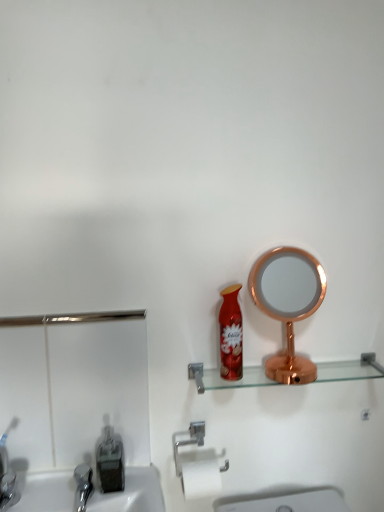
What do you see at coordinates (198, 465) in the screenshot? The image size is (384, 512). I see `silver metallic towel bar at lower center` at bounding box center [198, 465].

At what (x,y) coordinates should I click in order to perform the action: click on brushed metal sink at lower left. Please return your answer as a coordinate pair (x, y). The height and width of the screenshot is (512, 384). Looking at the image, I should click on (76, 407).

Is shiny red spray can at center bigger or smaller than brushed metal sink at lower left?

In the image, shiny red spray can at center appears to be smaller than brushed metal sink at lower left.

At what (x,y) coordinates should I click in order to perform the action: click on toiletry behind the brushed metal sink at lower left. Please return your answer as a coordinate pair (x, y). This screenshot has height=512, width=384. Looking at the image, I should click on pos(231,334).

Is shiny red spray can at center not inside brushed metal sink at lower left?

Absolutely, shiny red spray can at center is external to brushed metal sink at lower left.

Between point (234, 354) and point (53, 357), which one is positioned in front?

Point (234, 354)

Considering the relative positions of transparent glass shelf at center and brushed metal sink at lower left in the image provided, is transparent glass shelf at center in front of brushed metal sink at lower left?

No, transparent glass shelf at center is further to the viewer.

Is point (382, 374) positioned after point (54, 446)?

Yes, it is.

From the image's perspective, is transparent glass shelf at center above or below brushed metal sink at lower left?

Based on their image positions, transparent glass shelf at center is located above brushed metal sink at lower left.

How far apart are transparent glass shelf at center and brushed metal sink at lower left?

transparent glass shelf at center is 13.51 inches away from brushed metal sink at lower left.

Considering the sizes of copper metallic mirror at right and translucent plastic soap dispenser at lower left in the image, is copper metallic mirror at right taller or shorter than translucent plastic soap dispenser at lower left?

Clearly, copper metallic mirror at right is taller compared to translucent plastic soap dispenser at lower left.

Can you tell me how much copper metallic mirror at right and translucent plastic soap dispenser at lower left differ in facing direction?

0.507 degrees separate the facing orientations of copper metallic mirror at right and translucent plastic soap dispenser at lower left.

Which is behind, copper metallic mirror at right or translucent plastic soap dispenser at lower left?

translucent plastic soap dispenser at lower left is further from the camera.

The image size is (384, 512). What are the coordinates of `mirror on the right of translucent plastic soap dispenser at lower left` in the screenshot? It's located at (288, 304).

Can we say shiny red spray can at center lies outside transparent glass shelf at center?

Indeed, shiny red spray can at center is completely outside transparent glass shelf at center.

Between shiny red spray can at center and transparent glass shelf at center, which one has more height?

With more height is shiny red spray can at center.

Considering the sizes of shiny red spray can at center and transparent glass shelf at center in the image, is shiny red spray can at center bigger or smaller than transparent glass shelf at center?

Clearly, shiny red spray can at center is smaller in size than transparent glass shelf at center.

Looking at their sizes, would you say shiny red spray can at center is wider or thinner than transparent glass shelf at center?

In the image, shiny red spray can at center appears to be more narrow than transparent glass shelf at center.

Between brushed metal sink at lower left and shiny red spray can at center, which one appears on the left side from the viewer's perspective?

Positioned to the left is brushed metal sink at lower left.

Does brushed metal sink at lower left turn towards shiny red spray can at center?

No, brushed metal sink at lower left does not turn towards shiny red spray can at center.

Where is `sink located below the shiny red spray can at center (from the image's perspective)`? Image resolution: width=384 pixels, height=512 pixels. sink located below the shiny red spray can at center (from the image's perspective) is located at coordinates (76, 407).

From a real-world perspective, between shiny red spray can at center and translucent plastic soap dispenser at lower left, who is vertically lower?

In real-world perspective, translucent plastic soap dispenser at lower left is lower.

From the image's perspective, is shiny red spray can at center beneath translucent plastic soap dispenser at lower left?

Actually, shiny red spray can at center appears above translucent plastic soap dispenser at lower left in the image.

This screenshot has height=512, width=384. In order to click on bottle below the shiny red spray can at center (from the image's perspective) in this screenshot , I will do `click(110, 463)`.

Is silver metallic towel bar at lower center looking in the opposite direction of translucent plastic soap dispenser at lower left?

No, translucent plastic soap dispenser at lower left is not at the back of silver metallic towel bar at lower center.

Is silver metallic towel bar at lower center further to the viewer compared to translucent plastic soap dispenser at lower left?

That is True.

From a real-world perspective, between silver metallic towel bar at lower center and translucent plastic soap dispenser at lower left, who is vertically lower?

In real-world perspective, silver metallic towel bar at lower center is lower.

In order to click on sink located in front of the shiny red spray can at center in this screenshot , I will do `click(76, 407)`.

In order to click on sink located below the transparent glass shelf at center (from the image's perspective) in this screenshot , I will do `click(76, 407)`.

Based on their spatial positions, is copper metallic mirror at right or silver metallic towel bar at lower center closer to transparent glass shelf at center?

The object closer to transparent glass shelf at center is copper metallic mirror at right.

From the picture: Looking at the image, which one is located closer to transparent glass shelf at center, translucent plastic soap dispenser at lower left or copper metallic mirror at right?

copper metallic mirror at right is closer to transparent glass shelf at center.

Based on their spatial positions, is translucent plastic soap dispenser at lower left or transparent glass shelf at center closer to copper metallic mirror at right?

transparent glass shelf at center.

When comparing their distances from copper metallic mirror at right, does shiny red spray can at center or transparent glass shelf at center seem further?

The object further to copper metallic mirror at right is transparent glass shelf at center.

When comparing their distances from shiny red spray can at center, does copper metallic mirror at right or translucent plastic soap dispenser at lower left seem further?

The object further to shiny red spray can at center is translucent plastic soap dispenser at lower left.

Estimate the real-world distances between objects in this image. Which object is closer to copper metallic mirror at right, transparent glass shelf at center or brushed metal sink at lower left?

transparent glass shelf at center.

When comparing their distances from translucent plastic soap dispenser at lower left, does brushed metal sink at lower left or copper metallic mirror at right seem closer?

brushed metal sink at lower left is positioned closer to the anchor translucent plastic soap dispenser at lower left.

Which object lies further to the anchor point shiny red spray can at center, transparent glass shelf at center or copper metallic mirror at right?

transparent glass shelf at center is positioned further to the anchor shiny red spray can at center.

The width and height of the screenshot is (384, 512). In order to click on towel bar between brushed metal sink at lower left and shiny red spray can at center in this screenshot , I will do `click(198, 465)`.

Image resolution: width=384 pixels, height=512 pixels. What are the coordinates of `bottle between brushed metal sink at lower left and transparent glass shelf at center from left to right` in the screenshot? It's located at (110, 463).

The width and height of the screenshot is (384, 512). Identify the location of shelve between copper metallic mirror at right and silver metallic towel bar at lower center vertically. point(224,380).

Find the location of a particular element. This screenshot has height=512, width=384. toiletry between brushed metal sink at lower left and transparent glass shelf at center is located at coordinates (231, 334).